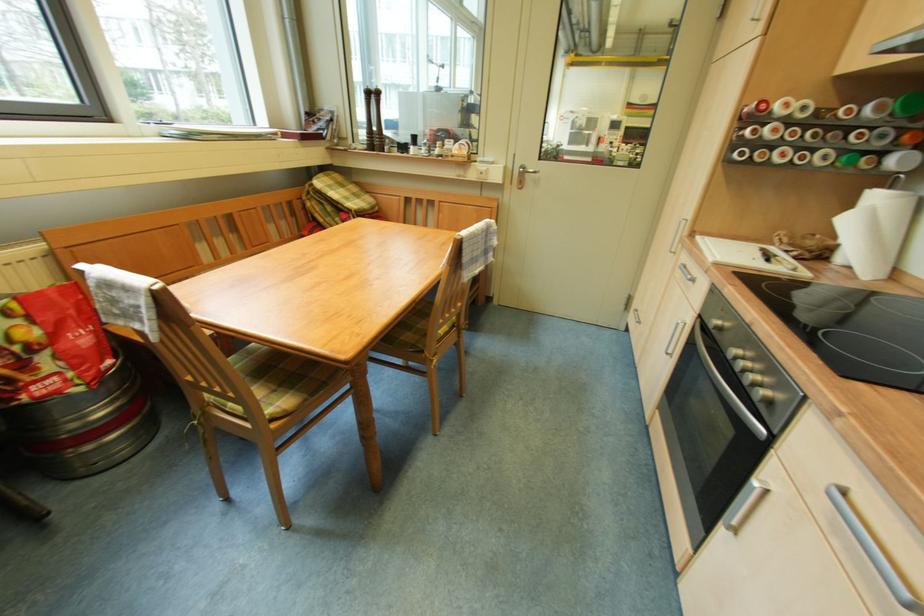
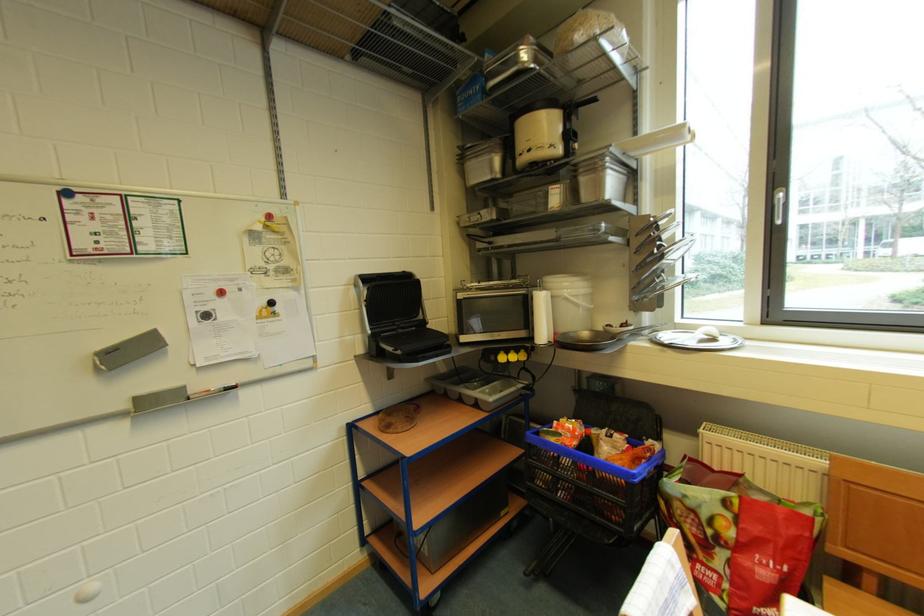
How did the camera likely rotate?

The camera rotated toward left-down.